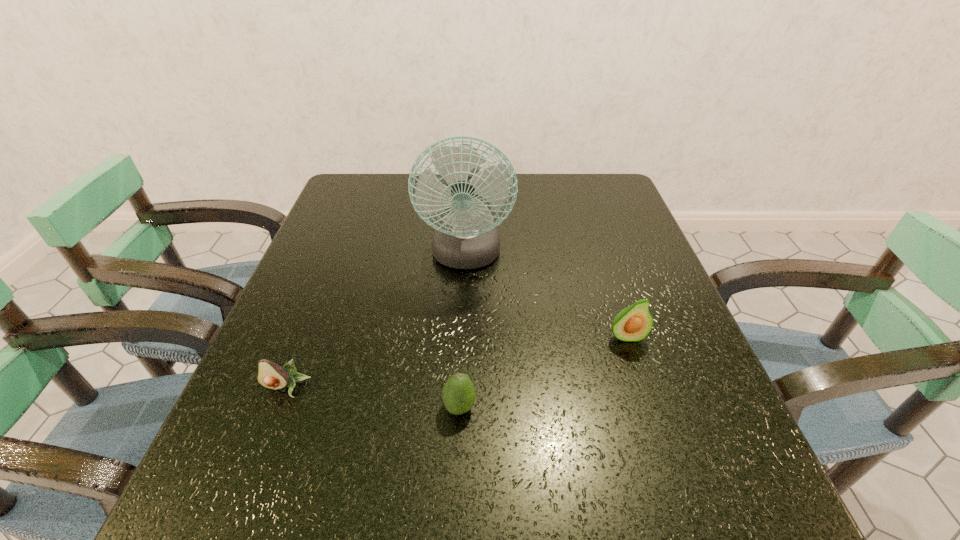
You are a GUI agent. You are given a task and a screenshot of the screen. Output one action in this format:
    pyautogui.click(x=<x>, y=<y>)
    Task: Click on the farthest object
    The height and width of the screenshot is (540, 960).
    Given the screenshot: What is the action you would take?
    pyautogui.click(x=467, y=239)

In order to click on the tallest object in this screenshot , I will do `click(467, 239)`.

In order to click on the rightmost avocado in this screenshot , I will do `click(634, 323)`.

Locate an element on the screen. Image resolution: width=960 pixels, height=540 pixels. the second farthest object is located at coordinates (634, 323).

The width and height of the screenshot is (960, 540). Find the location of `the second avocado from right to left`. the second avocado from right to left is located at coordinates (458, 394).

In order to click on the leftmost avocado in this screenshot , I will do `click(270, 375)`.

Locate an element on the screen. The height and width of the screenshot is (540, 960). free space located in front of the tallest object where the airflow is directed is located at coordinates (463, 350).

At what (x,y) coordinates should I click in order to perform the action: click on vacant region located 0.070m on the cut side of the rightmost avocado. Please return your answer as a coordinate pair (x, y). The width and height of the screenshot is (960, 540). Looking at the image, I should click on (639, 376).

I want to click on free spot located on the right of the second avocado from right to left, so click(x=529, y=407).

At what (x,y) coordinates should I click in order to perform the action: click on blank area located 0.100m on the seed side of the leftmost object. Please return your answer as a coordinate pair (x, y). Image resolution: width=960 pixels, height=540 pixels. Looking at the image, I should click on (261, 454).